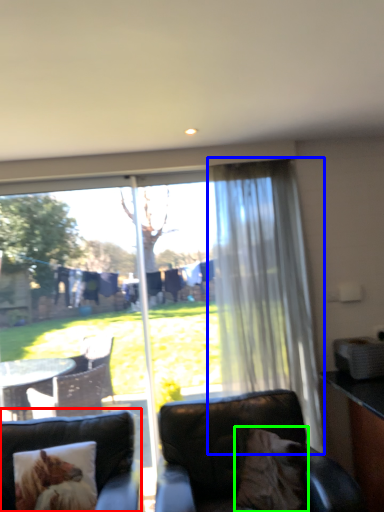
Question: Estimate the real-world distances between objects in this image. Which object is farther from studio couch (highlighted by a red box), curtain (highlighted by a blue box) or pillow (highlighted by a green box)?

Choices:
 (A) curtain
 (B) pillow

Answer: (A)